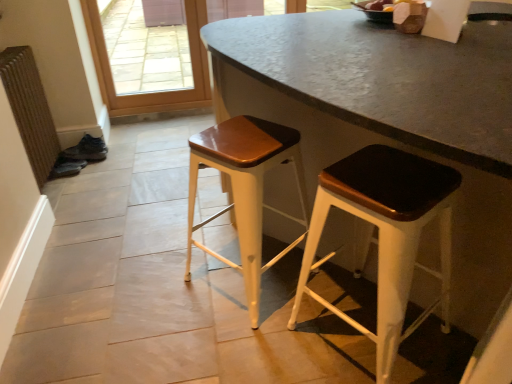
The width and height of the screenshot is (512, 384). I want to click on free point above matte black stool at center, which is counted as the first stool, starting from the right (from a real-world perspective), so click(x=394, y=173).